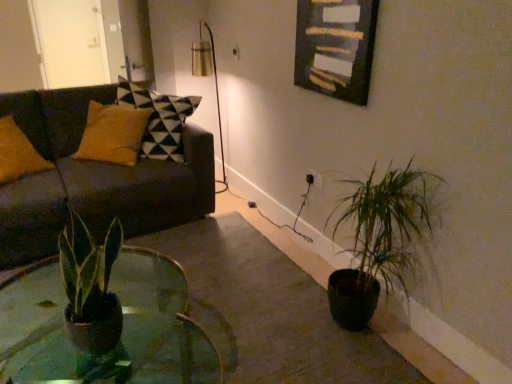
Where is `free spot in front of metallic gold table lamp at upper center`? free spot in front of metallic gold table lamp at upper center is located at coordinates (225, 201).